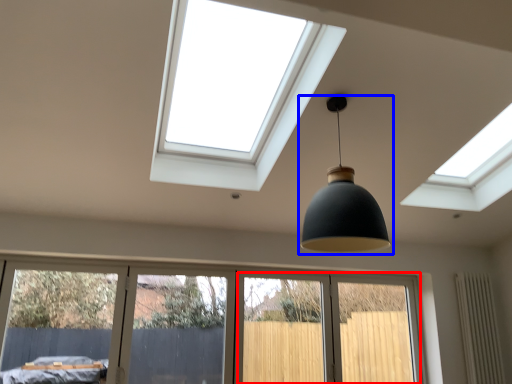
Question: Among these objects, which one is farthest to the camera, screen door (highlighted by a red box) or lamp (highlighted by a blue box)?

Choices:
 (A) screen door
 (B) lamp

Answer: (A)